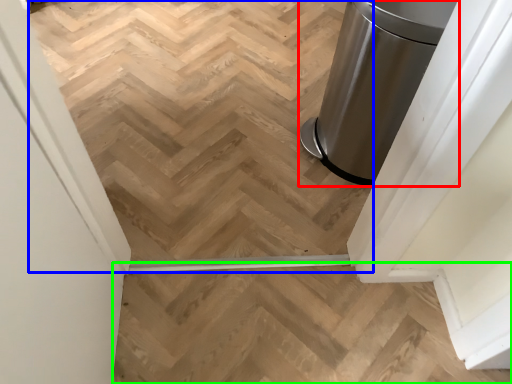
Question: Considering the real-world distances, which object is farthest from waste container (highlighted by a red box)? stairwell (highlighted by a blue box) or stairs (highlighted by a green box)?

Choices:
 (A) stairwell
 (B) stairs

Answer: (B)